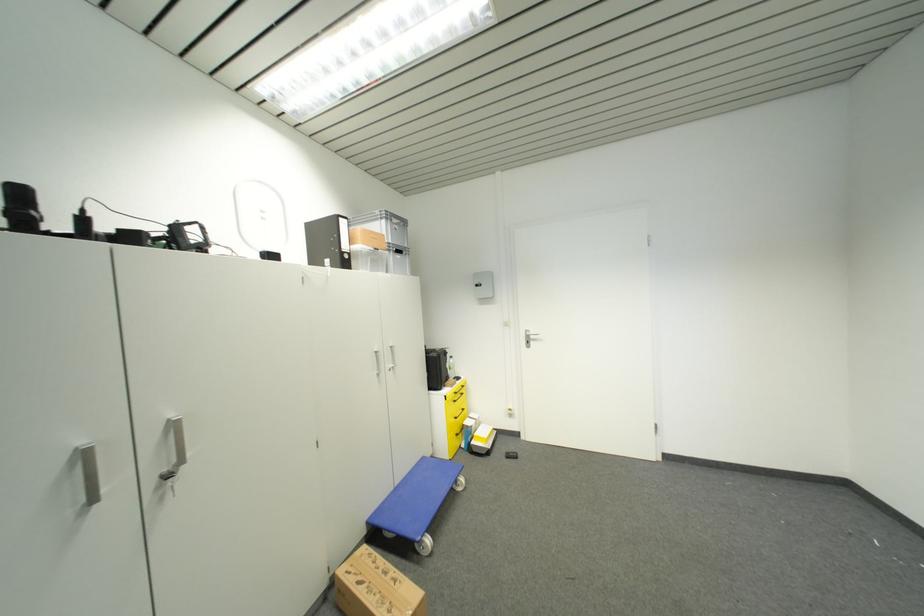
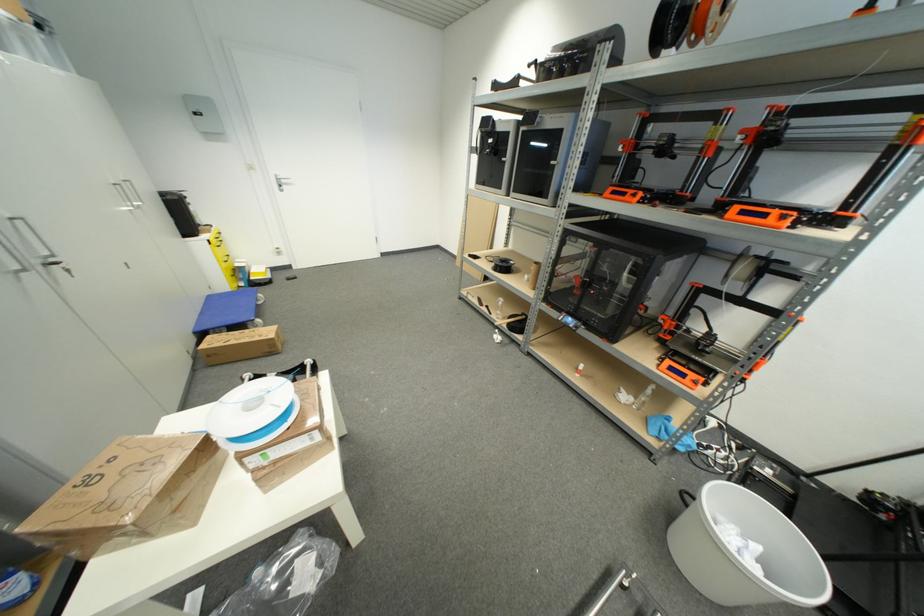
In the second image, find the point that corresponds to [369,549] in the first image.

(213, 339)